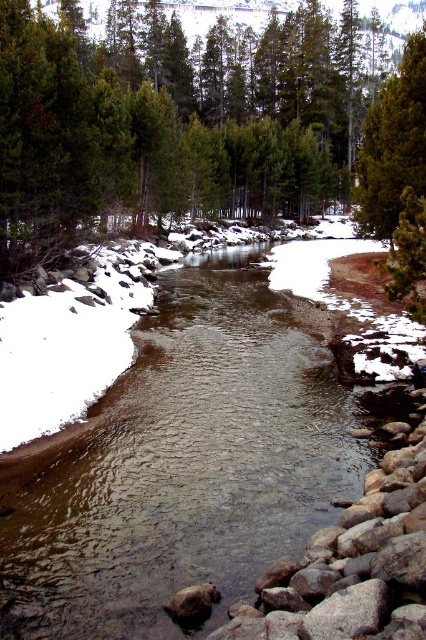
Who is more forward, [290,36] or [391,218]?

Positioned in front is point [391,218].

Between green matte tree at center and green matte tree at upper center, which one is positioned lower?

green matte tree at upper center is below.

This screenshot has height=640, width=426. Describe the element at coordinates (169, 120) in the screenshot. I see `green matte tree at center` at that location.

Where is `green matte tree at center`? green matte tree at center is located at coordinates (169, 120).